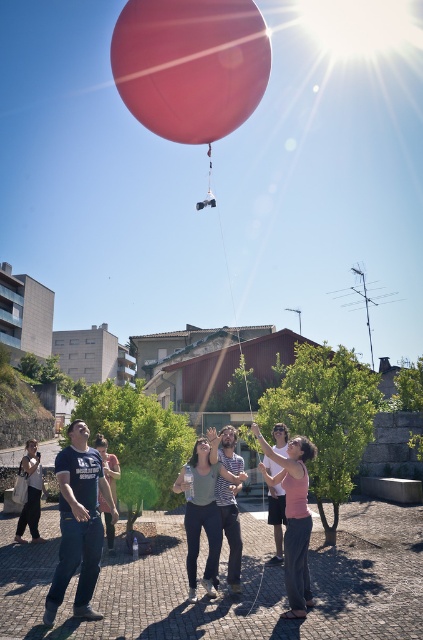
You are a photographer trying to capture a photo of the matte green shirt at center and the striped shirt at center. If you want to ensure both are in focus, which one should you focus on first to account for their heights?

The matte green shirt at center is taller than the striped shirt at center, so you should focus on the matte green shirt at center first to ensure both are in focus.